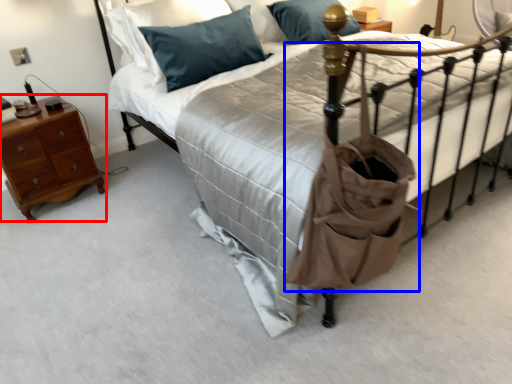
Question: Among these objects, which one is farthest to the camera, nightstand (highlighted by a red box) or bag (highlighted by a blue box)?

Choices:
 (A) nightstand
 (B) bag

Answer: (A)